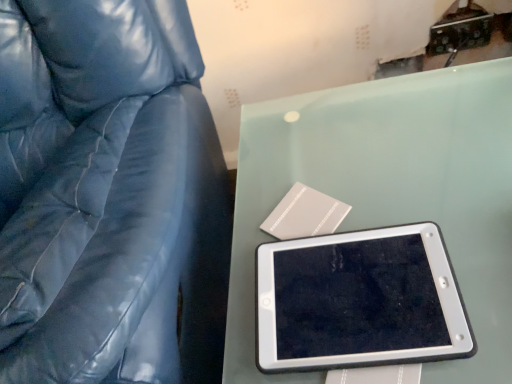
Question: Based on their sizes in the image, would you say black plastic tablet at center is bigger or smaller than matte blue leather chair at left?

Choices:
 (A) big
 (B) small

Answer: (B)

Question: In the image, is black plastic tablet at center on the left side or the right side of matte blue leather chair at left?

Choices:
 (A) right
 (B) left

Answer: (A)

Question: Looking at their shapes, would you say black plastic tablet at center is wider or thinner than matte blue leather chair at left?

Choices:
 (A) thin
 (B) wide

Answer: (A)

Question: Relative to black plastic tablet at center, is matte blue leather chair at left in front or behind?

Choices:
 (A) behind
 (B) front

Answer: (B)

Question: Looking at the image, does matte blue leather chair at left seem bigger or smaller compared to black plastic tablet at center?

Choices:
 (A) big
 (B) small

Answer: (A)

Question: Is matte blue leather chair at left to the left or to the right of black plastic tablet at center in the image?

Choices:
 (A) right
 (B) left

Answer: (B)

Question: Is point (68, 309) closer or farther from the camera than point (446, 286)?

Choices:
 (A) closer
 (B) farther

Answer: (A)